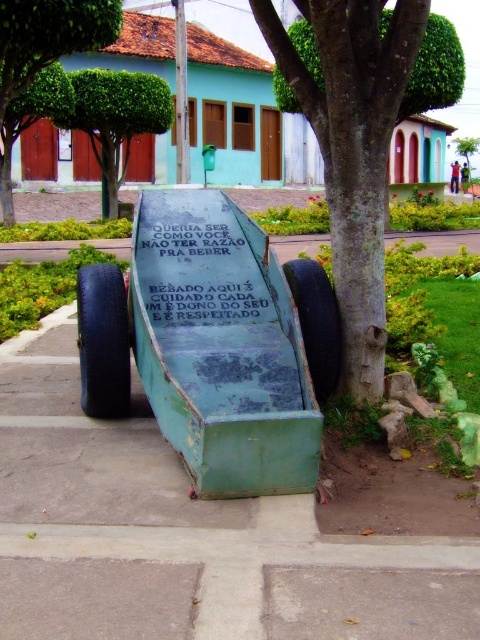
Describe the element at coordinates (115, 116) in the screenshot. I see `green leafy tree at upper left` at that location.

Which of these two, green leafy tree at upper left or rubber tire at lower center, stands shorter?

Standing shorter between the two is rubber tire at lower center.

Image resolution: width=480 pixels, height=640 pixels. Identify the location of green leafy tree at upper left. (115, 116).

Identify the location of green leafy tree at upper left. The height and width of the screenshot is (640, 480). (115, 116).

Who is more distant from viewer, (87,412) or (465,148)?

The point (465,148) is behind.

Does point (85, 364) lie in front of point (468, 140)?

That is True.

Is point (95, 300) positioned before point (468, 164)?

Yes, point (95, 300) is in front of point (468, 164).

In order to click on black rubber tire at lower left in this screenshot , I will do `click(103, 340)`.

Between green painted metal sign at center and rubber tire at lower center, which one appears on the right side from the viewer's perspective?

rubber tire at lower center is more to the right.

This screenshot has width=480, height=640. I want to click on green painted metal sign at center, so click(x=200, y=275).

This screenshot has width=480, height=640. I want to click on green painted metal sign at center, so click(200, 275).